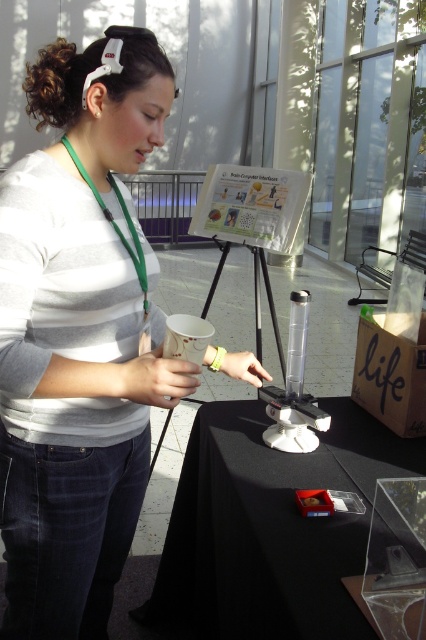
You are a photographer at the event and need to capture a clear photo of the clear plastic tube at center without the white matte shirt at upper left blocking it. How should you adjust your camera angle?

The white matte shirt at upper left is located above the clear plastic tube at center, so you can lower your camera angle to avoid the shirt blocking the tube.

You are an event organizer who needs to arrange a photo shoot. You want to ensure the white matte shirt at upper left and the black matte table at center are visible in the frame. Based on their positions, which object should be placed closer to the camera to ensure both are in focus?

The white matte shirt at upper left is to the left of the black matte table at center. To ensure both are in focus, the black matte table at center should be placed closer to the camera since it is further away from the shirt, allowing for a greater depth of field.